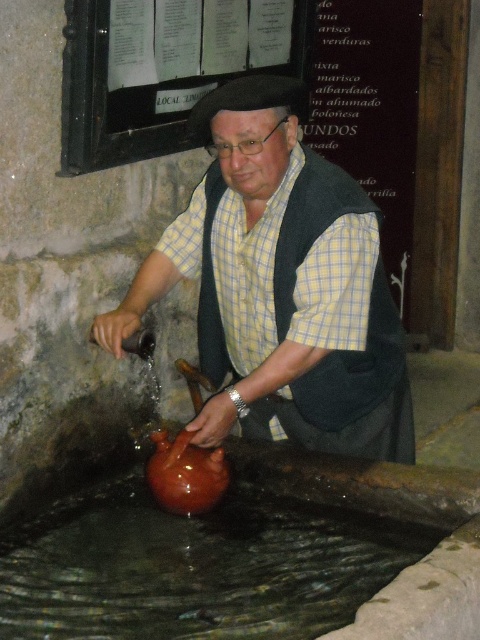
In the scene shown: Which is above, matte brown jug at center or brown matte water at lower center?

matte brown jug at center

Is matte brown jug at center taller than brown matte water at lower center?

Indeed, matte brown jug at center has a greater height compared to brown matte water at lower center.

Find the location of a particular element. Image resolution: width=480 pixels, height=640 pixels. matte brown jug at center is located at coordinates (280, 285).